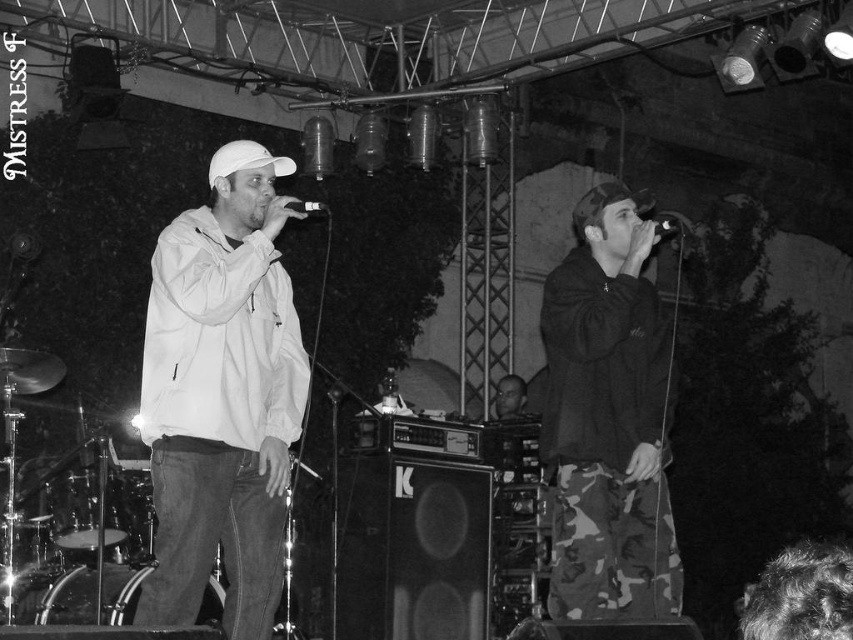
You are a stagehand setting up for a performance. You need to place a new amplifier that is the same size as the metallic black microphone at center between the camo pants at right and the drum set on the left. Will the amplifier fit between them?

The camo pants at right has a larger size compared to the metallic black microphone at center. Since the amplifier is the same size as the microphone, it will fit between the camo pants at right and the drum set on the left as there is sufficient space.

In the scene shown: You are a photographer at the back of the venue and want to take a photo of the smooth skin head at center and the metallic black microphone at center. Which object will appear larger in your photo?

The smooth skin head at center is taller than the metallic black microphone at center, so it will appear larger in the photo.

You are a photographer adjusting the lighting for a stage performance. You need to ensure that the spotlight hits the smooth skin head at center. Given that the spotlight is currently positioned at point (x=509, y=396), is it correctly aimed?

The point (x=509, y=396) corresponds to the smooth skin head at center, so yes, the spotlight is correctly aimed at the smooth skin head at center.